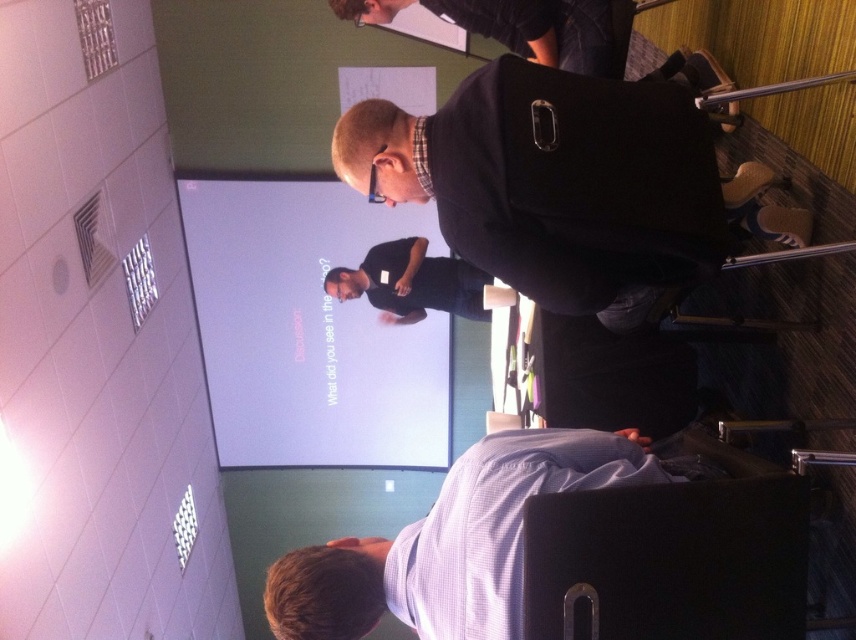
Is white glossy projector screen at upper center closer to the viewer compared to black leather chair at lower right?

No.

The height and width of the screenshot is (640, 856). Identify the location of white glossy projector screen at upper center. (308, 328).

Between point (194, 304) and point (798, 625), which one is positioned in front?

Point (798, 625)

What are the coordinates of `white glossy projector screen at upper center` in the screenshot? It's located at (308, 328).

Is matte black jacket at center closer to the viewer compared to white glossy projector screen at upper center?

Yes.

Between matte black jacket at center and white glossy projector screen at upper center, which one is positioned lower?

white glossy projector screen at upper center is below.

Does point (458, 225) come closer to viewer compared to point (397, 388)?

Yes, point (458, 225) is in front of point (397, 388).

Locate an element on the screen. The width and height of the screenshot is (856, 640). matte black jacket at center is located at coordinates (559, 184).

Is black leather chair at lower right smaller than light blue shirt at lower center?

Correct, black leather chair at lower right occupies less space than light blue shirt at lower center.

Does black leather chair at lower right have a larger size compared to light blue shirt at lower center?

No, black leather chair at lower right is not bigger than light blue shirt at lower center.

Is point (535, 566) closer to viewer compared to point (450, 525)?

Yes, it is in front of point (450, 525).

At what (x,y) coordinates should I click in order to perform the action: click on black leather chair at lower right. Please return your answer as a coordinate pair (x, y). The image size is (856, 640). Looking at the image, I should click on (672, 560).